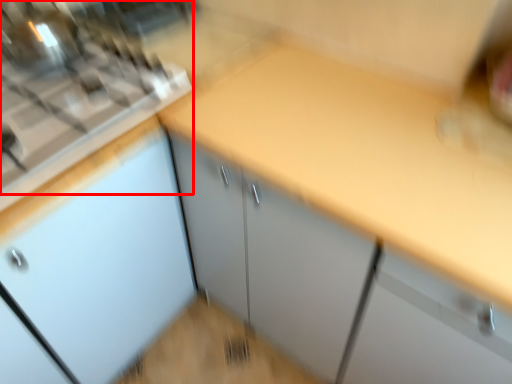
Question: From the image, what is the correct spatial relationship of gas stove (annotated by the red box) in relation to countertop?

Choices:
 (A) right
 (B) left

Answer: (B)